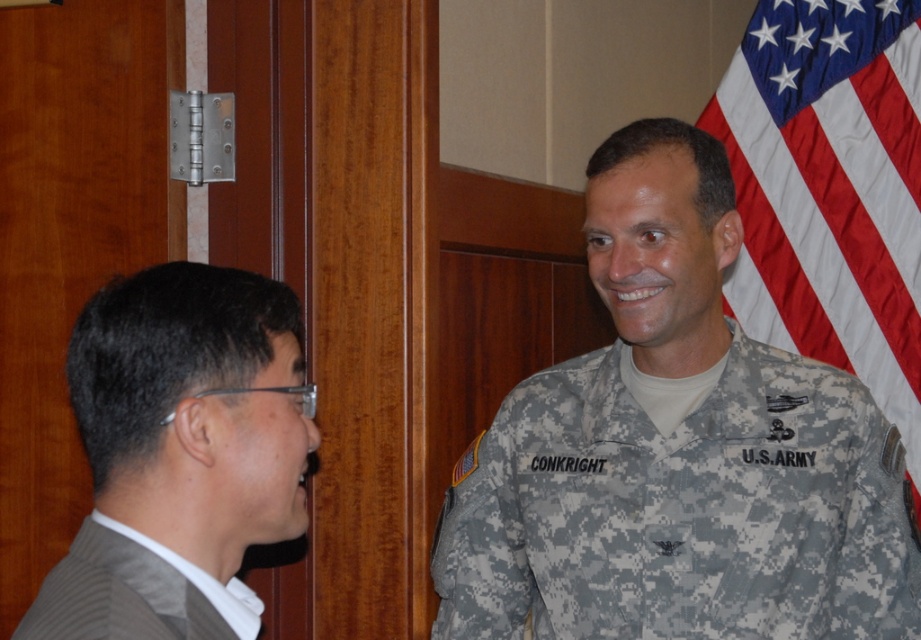
Question: Is the position of camouflage uniform at right more distant than that of gray pleated suit at left?

Choices:
 (A) yes
 (B) no

Answer: (A)

Question: Among these objects, which one is nearest to the camera?

Choices:
 (A) american flag at right
 (B) gray pleated suit at left
 (C) gray suit at left
 (D) camouflage uniform at right

Answer: (B)

Question: Can you confirm if gray suit at left is positioned to the left of gray pleated suit at left?

Choices:
 (A) no
 (B) yes

Answer: (A)

Question: Among these points, which one is farthest from the camera?

Choices:
 (A) (644, 241)
 (B) (201, 580)
 (C) (113, 580)

Answer: (A)

Question: Which object is farther from the camera taking this photo?

Choices:
 (A) camouflage uniform at right
 (B) gray pleated suit at left
 (C) gray suit at left
 (D) american flag at right

Answer: (D)

Question: Does gray suit at left appear over gray pleated suit at left?

Choices:
 (A) no
 (B) yes

Answer: (B)